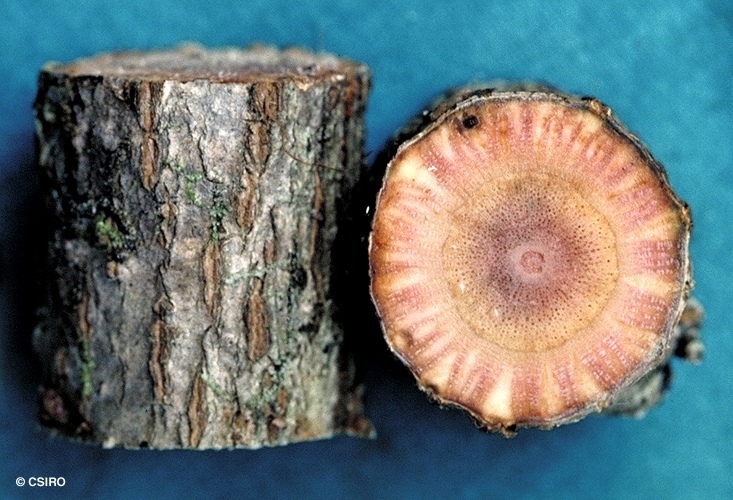
You are a GUI agent. You are given a task and a screenshot of the screen. Output one action in this format:
    pyautogui.click(x=<x>, y=<y>)
    Task: Click on the cracks in the wood
    The height and width of the screenshot is (500, 733).
    Given the screenshot: What is the action you would take?
    pyautogui.click(x=251, y=319), pyautogui.click(x=155, y=344), pyautogui.click(x=254, y=134), pyautogui.click(x=150, y=143)